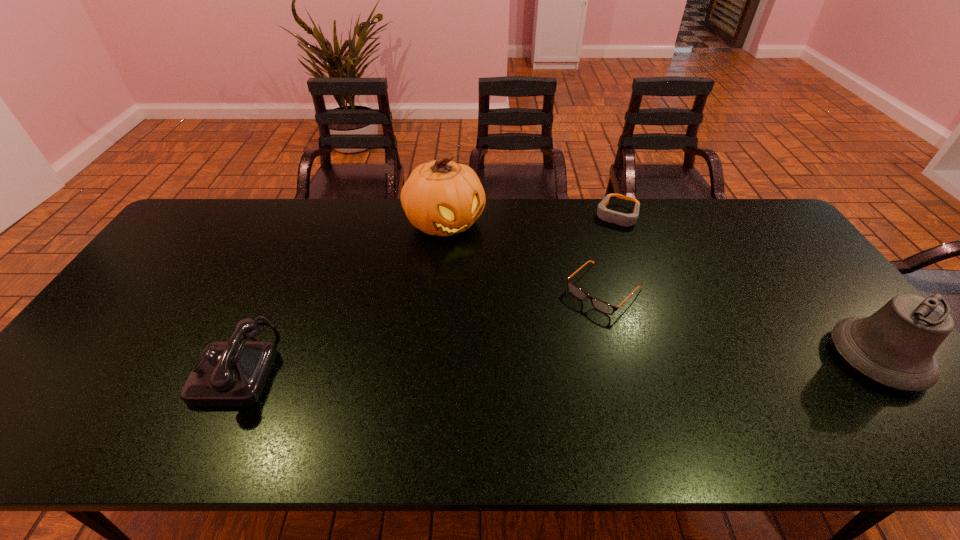
This screenshot has height=540, width=960. I want to click on vacant space at the far left corner of the desktop, so click(x=210, y=224).

I want to click on vacant space at the near left corner of the desktop, so click(116, 378).

You are a GUI agent. You are given a task and a screenshot of the screen. Output one action in this format:
    pyautogui.click(x=<x>, y=<y>)
    Task: Click on the free space at the far right corner
    
    Given the screenshot: What is the action you would take?
    pyautogui.click(x=732, y=209)

I want to click on free space between the bell and the third tallest object, so click(559, 361).

I want to click on vacant space that is in between the tallest object and the spectacles, so click(x=524, y=256).

Locate an element on the screen. vacant area that lies between the third farthest object and the tallest object is located at coordinates (524, 256).

Where is `vacant area that lies between the pumpkin and the goggles`? The height and width of the screenshot is (540, 960). vacant area that lies between the pumpkin and the goggles is located at coordinates (531, 219).

Identify the location of vacant area between the third farthest object and the goggles. Image resolution: width=960 pixels, height=540 pixels. (611, 253).

Locate an element on the screen. This screenshot has height=540, width=960. free space between the spectacles and the third shortest object is located at coordinates (421, 326).

The height and width of the screenshot is (540, 960). Identify the location of vacant region between the rightmost object and the goggles. (747, 287).